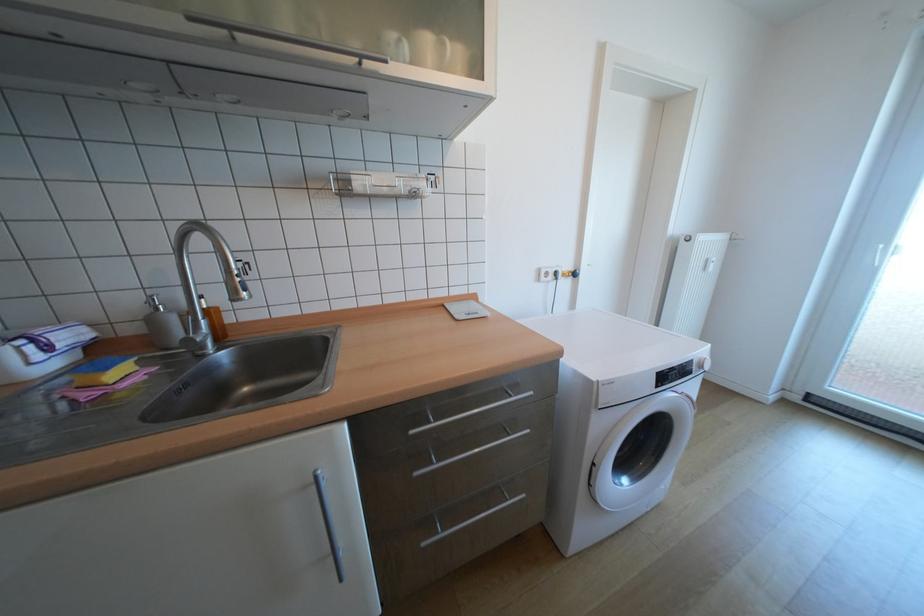
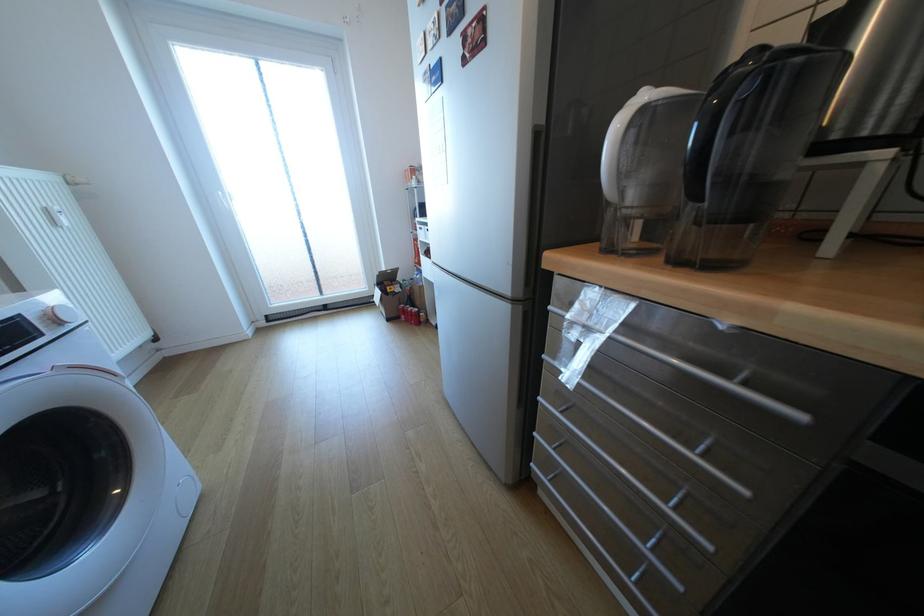
The first image is from the beginning of the video and the second image is from the end. How did the camera likely rotate when shooting the video?

The camera's rotation is toward right-down.